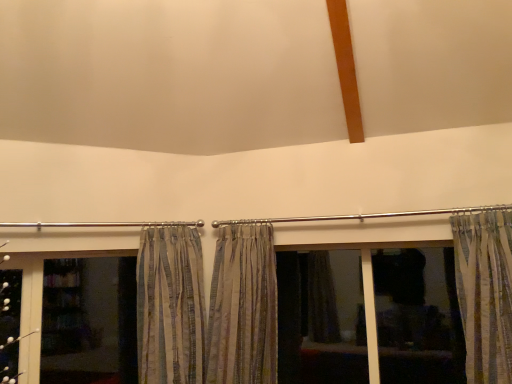
Question: Should I look upward or downward to see striped fabric curtain at center, the second curtain in the right-to-left sequence?

Choices:
 (A) up
 (B) down

Answer: (B)

Question: Should I look upward or downward to see striped fabric curtain at center, the first curtain in the left-to-right sequence?

Choices:
 (A) up
 (B) down

Answer: (B)

Question: Does dark fabric curtain at center have a lesser height compared to transparent glass screen door at lower left?

Choices:
 (A) no
 (B) yes

Answer: (A)

Question: Is dark fabric curtain at center at the left side of transparent glass screen door at lower left?

Choices:
 (A) yes
 (B) no

Answer: (B)

Question: From the image's perspective, is dark fabric curtain at center above transparent glass screen door at lower left?

Choices:
 (A) no
 (B) yes

Answer: (B)

Question: From a real-world perspective, is dark fabric curtain at center positioned over transparent glass screen door at lower left based on gravity?

Choices:
 (A) yes
 (B) no

Answer: (B)

Question: Can you confirm if dark fabric curtain at center is bigger than transparent glass screen door at lower left?

Choices:
 (A) yes
 (B) no

Answer: (A)

Question: From the image's perspective, does dark fabric curtain at center appear lower than transparent glass screen door at lower left?

Choices:
 (A) no
 (B) yes

Answer: (A)

Question: Considering the relative positions of striped fabric curtain at right, which ranks as the third curtain in left-to-right order, and striped fabric curtain at center, the second curtain in the left-to-right sequence, in the image provided, is striped fabric curtain at right, which ranks as the third curtain in left-to-right order, to the left of striped fabric curtain at center, the second curtain in the left-to-right sequence, from the viewer's perspective?

Choices:
 (A) no
 (B) yes

Answer: (A)

Question: Is striped fabric curtain at right, the first curtain from the right, positioned behind striped fabric curtain at center, the second curtain in the right-to-left sequence?

Choices:
 (A) no
 (B) yes

Answer: (A)

Question: Considering the relative sizes of striped fabric curtain at right, the first curtain from the right, and striped fabric curtain at center, the second curtain in the left-to-right sequence, in the image provided, is striped fabric curtain at right, the first curtain from the right, thinner than striped fabric curtain at center, the second curtain in the left-to-right sequence,?

Choices:
 (A) yes
 (B) no

Answer: (A)

Question: From a real-world perspective, is striped fabric curtain at right, the first curtain from the right, positioned under striped fabric curtain at center, the second curtain in the left-to-right sequence, based on gravity?

Choices:
 (A) no
 (B) yes

Answer: (A)

Question: Is striped fabric curtain at right, which ranks as the third curtain in left-to-right order, wider than striped fabric curtain at center, the second curtain in the left-to-right sequence?

Choices:
 (A) no
 (B) yes

Answer: (A)

Question: Is striped fabric curtain at right, the first curtain from the right, looking in the opposite direction of striped fabric curtain at center, the second curtain in the left-to-right sequence?

Choices:
 (A) yes
 (B) no

Answer: (B)

Question: Can you confirm if transparent glass screen door at lower left is smaller than striped fabric curtain at center, the second curtain in the left-to-right sequence?

Choices:
 (A) yes
 (B) no

Answer: (A)